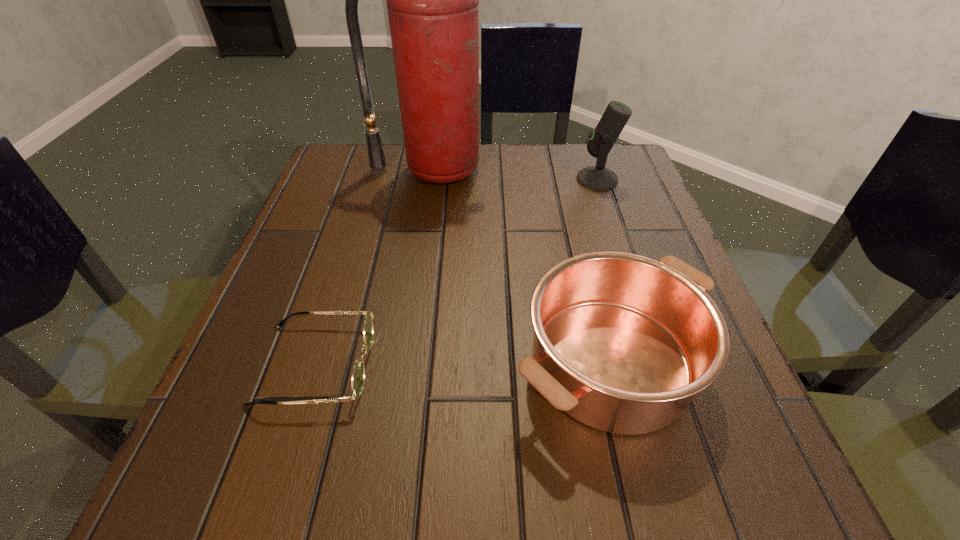
Identify the location of object positioned at the near edge. This screenshot has height=540, width=960. (622, 343).

Image resolution: width=960 pixels, height=540 pixels. Find the location of `fire extinguisher located at the left edge`. fire extinguisher located at the left edge is located at coordinates (432, 0).

Image resolution: width=960 pixels, height=540 pixels. What are the coordinates of `spectacles present at the left edge` in the screenshot? It's located at (358, 373).

Locate an element on the screen. This screenshot has width=960, height=540. microphone that is at the right edge is located at coordinates (602, 139).

Where is `saucepan that is positioned at the right edge`? saucepan that is positioned at the right edge is located at coordinates (622, 343).

Locate an element on the screen. object that is positioned at the far left corner is located at coordinates tap(432, 0).

In order to click on object present at the far right corner in this screenshot , I will do `click(602, 139)`.

Identify the location of object that is at the near right corner. (622, 343).

At what (x,y) coordinates should I click in order to perform the action: click on free space at the far edge. Please return your answer as a coordinate pair (x, y). Looking at the image, I should click on (469, 186).

At what (x,y) coordinates should I click in order to perform the action: click on free space at the near edge of the desktop. Please return your answer as a coordinate pair (x, y). Looking at the image, I should click on (558, 468).